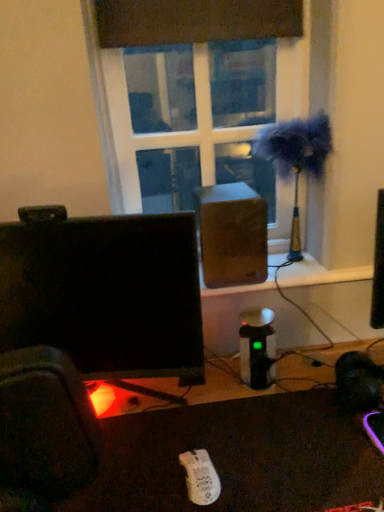
Find the location of `spots to the right of white matte wii controller at lower center`. spots to the right of white matte wii controller at lower center is located at coordinates (271, 466).